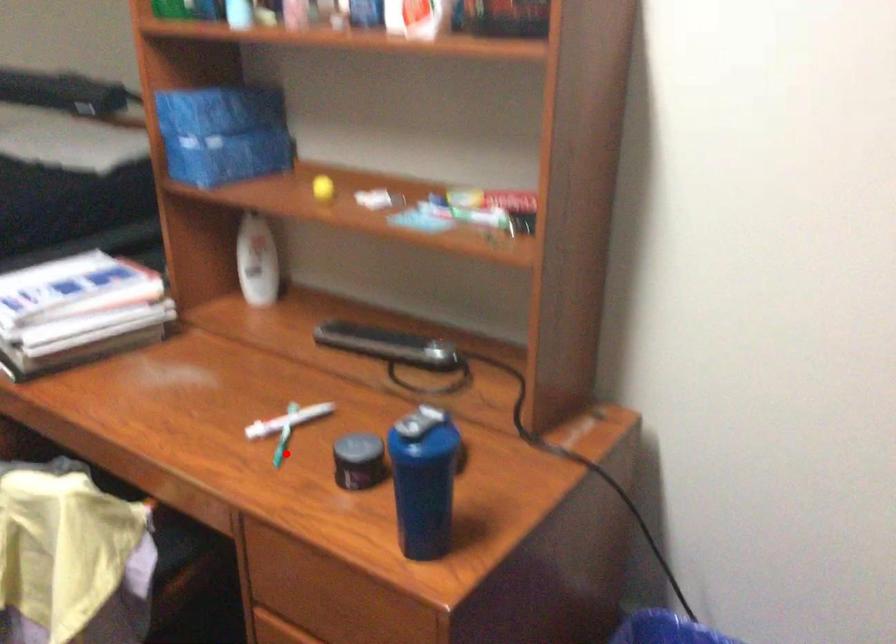
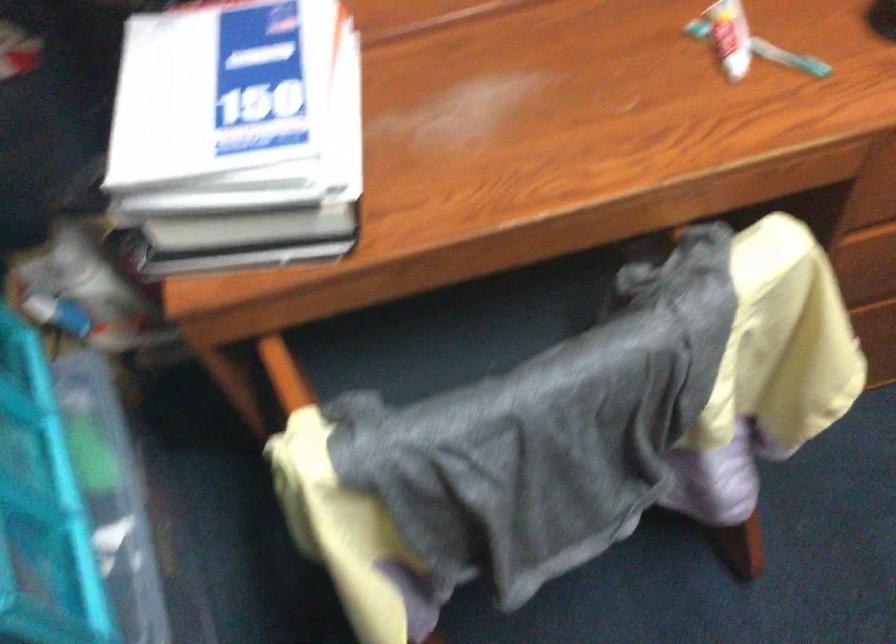
Locate, in the second image, the point that corresponds to the highlighted location in the first image.

(789, 58)